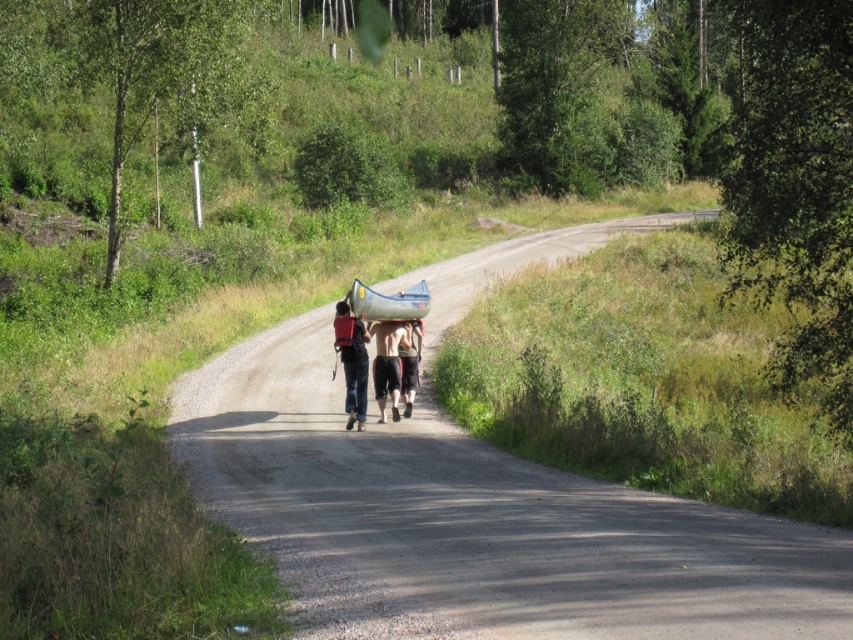
Does point (599, 483) come behind point (368, 317)?

No, it is in front of (368, 317).

Between smooth asphalt road at center and green rubber canoe at center, which one is positioned higher?

Positioned higher is green rubber canoe at center.

This screenshot has height=640, width=853. In order to click on smooth asphalt road at center in this screenshot , I will do `click(476, 522)`.

Between matte blue jeans at center and green rubber canoe at center, which one is positioned higher?

green rubber canoe at center is above.

Can you confirm if matte blue jeans at center is bigger than green rubber canoe at center?

Yes.

Is point (364, 403) positioned after point (370, 294)?

Yes, point (364, 403) is behind point (370, 294).

Locate an element on the screen. The height and width of the screenshot is (640, 853). matte blue jeans at center is located at coordinates (352, 362).

Can you confirm if smooth asphalt road at center is smaller than tan cotton shorts at center?

Incorrect, smooth asphalt road at center is not smaller in size than tan cotton shorts at center.

Between smooth asphalt road at center and tan cotton shorts at center, which one is positioned lower?

smooth asphalt road at center is below.

Describe the element at coordinates (476, 522) in the screenshot. I see `smooth asphalt road at center` at that location.

The height and width of the screenshot is (640, 853). Find the location of `smooth asphalt road at center`. smooth asphalt road at center is located at coordinates (476, 522).